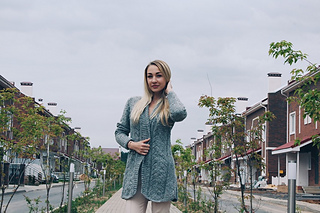
The width and height of the screenshot is (320, 213). Find the location of `entry`. entry is located at coordinates (313, 174).